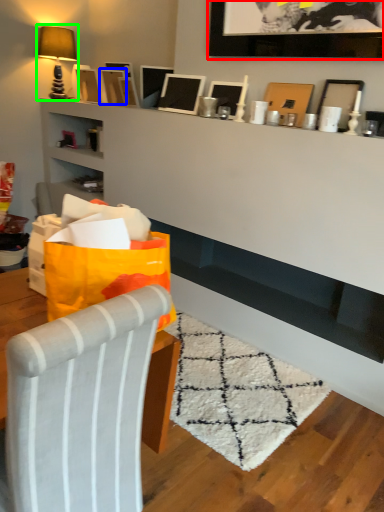
Question: Which object is the farthest from picture frame (highlighted by a red box)? Choose among these: picture frame (highlighted by a blue box) or table lamp (highlighted by a green box).

Choices:
 (A) picture frame
 (B) table lamp

Answer: (B)